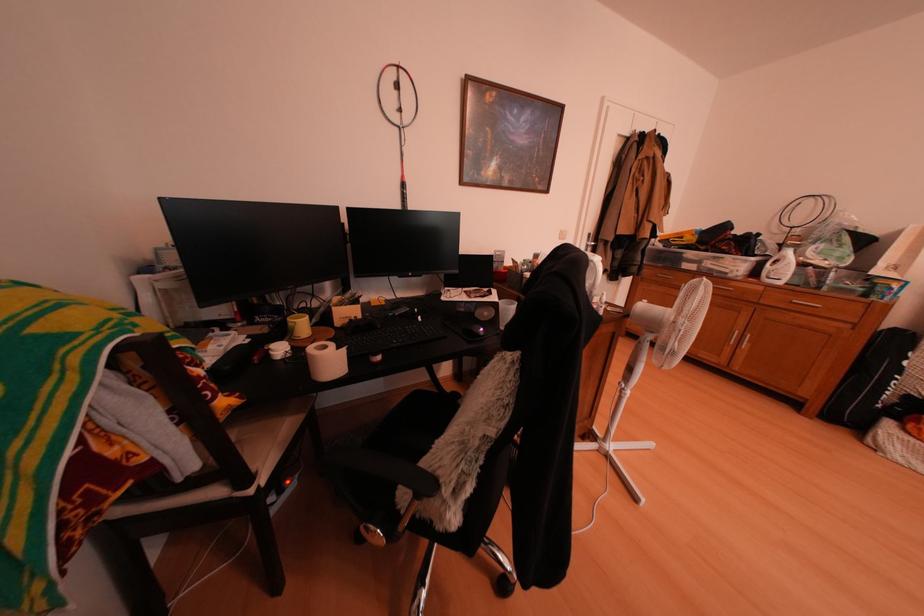
The height and width of the screenshot is (616, 924). Describe the element at coordinates (420, 413) in the screenshot. I see `the chair sitting surface` at that location.